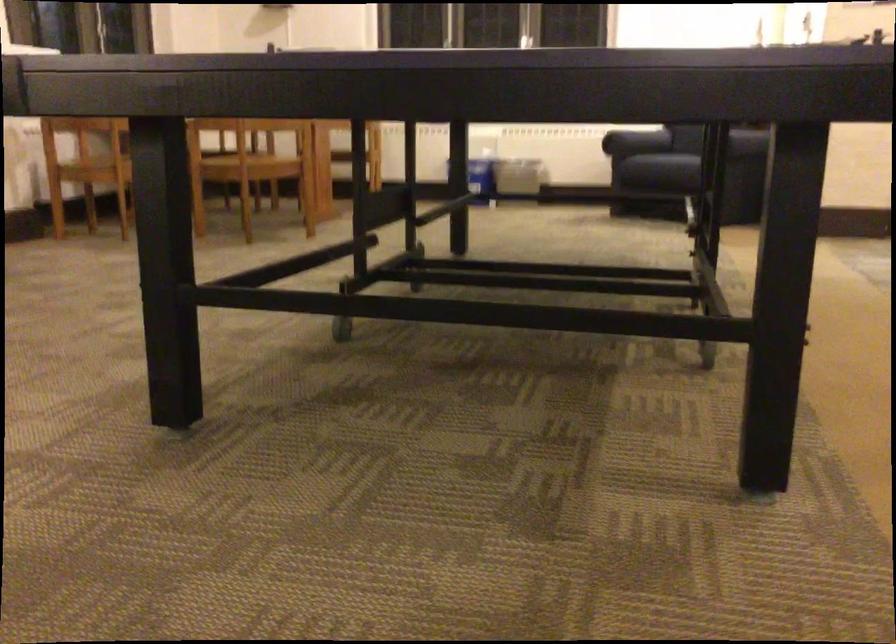
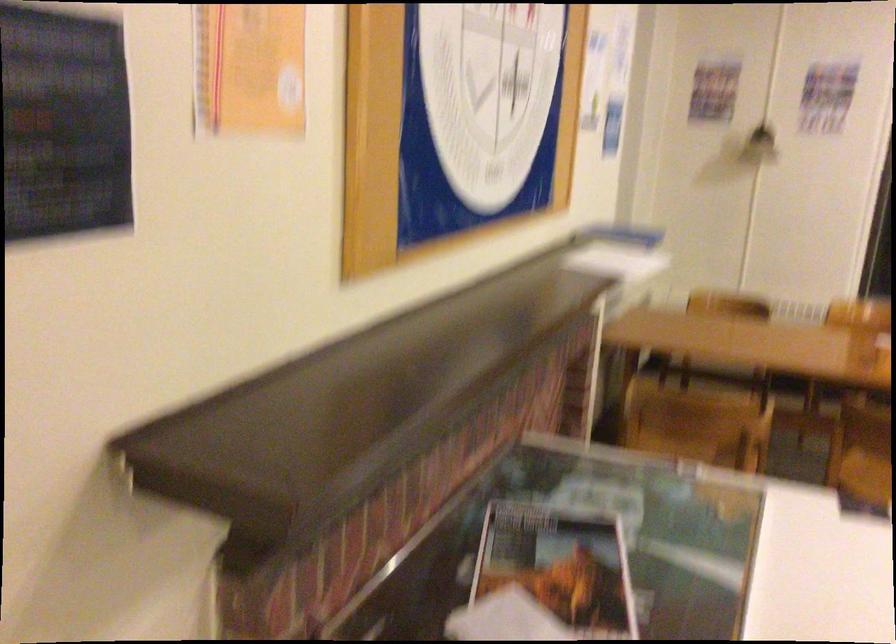
Question: I am providing you with two images of the same scene from different viewpoints. Please identify which objects are invisible in image2.

Choices:
 (A) ceiling lightbulb
 (B) small magazine
 (C) chair sitting surface
 (D) stack of papers

Answer: (C)